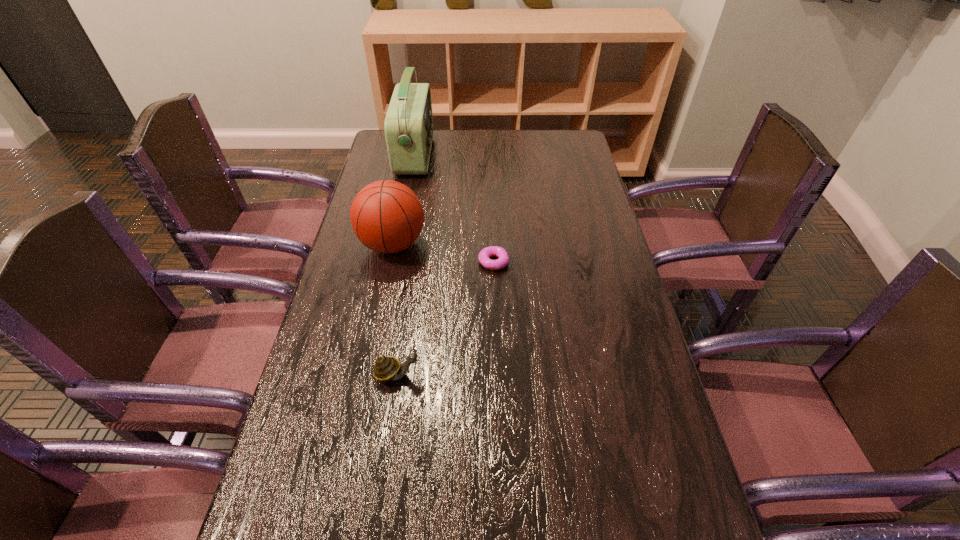
The width and height of the screenshot is (960, 540). Find the location of `the tallest object`. the tallest object is located at coordinates (408, 126).

At what (x,y) coordinates should I click in order to perform the action: click on the farthest object. Please return your answer as a coordinate pair (x, y). The width and height of the screenshot is (960, 540). Looking at the image, I should click on (408, 126).

This screenshot has height=540, width=960. What are the coordinates of `basketball` in the screenshot? It's located at (386, 216).

Identify the location of snail. The image size is (960, 540). (x=386, y=368).

You are a GUI agent. You are given a task and a screenshot of the screen. Output one action in this format:
    pyautogui.click(x=<x>, y=<y>)
    Task: Click on the nearest object
    
    Given the screenshot: What is the action you would take?
    pyautogui.click(x=386, y=368)

This screenshot has height=540, width=960. I want to click on doughnut, so click(503, 258).

Where is `the shortest object`? the shortest object is located at coordinates 503,258.

You are a GUI agent. You are given a task and a screenshot of the screen. Output one action in this format:
    pyautogui.click(x=<x>, y=<y>)
    Task: Click on the blank area located on the front panel of the tallest object
    The image size is (960, 540).
    Given the screenshot: What is the action you would take?
    pyautogui.click(x=531, y=156)

Find the location of a particular element. Image resolution: width=960 pixels, height=540 pixels. vacant region located on the back of the second tallest object is located at coordinates [x=401, y=202].

In order to click on blank space located on the face of the snail in this screenshot , I will do `click(576, 374)`.